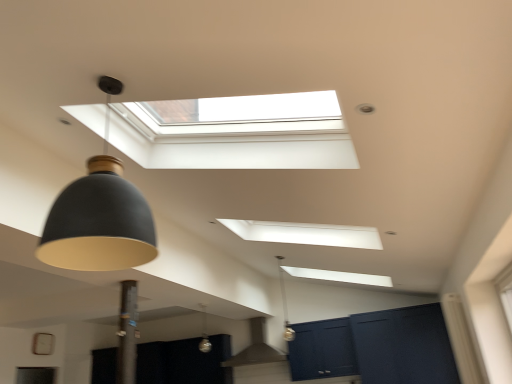
Question: Which direction should I rotate to face matte black pendant light at center, which is the third lamp from left to right, — up or down?

Choices:
 (A) down
 (B) up

Answer: (A)

Question: Is matte gray exhaust hood at center directly adjacent to white matte window at right?

Choices:
 (A) no
 (B) yes

Answer: (A)

Question: Can you confirm if matte gray exhaust hood at center is positioned to the left of white matte window at right?

Choices:
 (A) no
 (B) yes

Answer: (B)

Question: Does matte gray exhaust hood at center have a greater width compared to white matte window at right?

Choices:
 (A) yes
 (B) no

Answer: (A)

Question: Is matte gray exhaust hood at center oriented away from white matte window at right?

Choices:
 (A) yes
 (B) no

Answer: (B)

Question: From the image's perspective, is matte gray exhaust hood at center beneath white matte window at right?

Choices:
 (A) yes
 (B) no

Answer: (A)

Question: Can we say matte gray exhaust hood at center lies outside white matte window at right?

Choices:
 (A) yes
 (B) no

Answer: (A)

Question: Considering the relative sizes of white matte window at right and matte dark blue cabinet at lower right in the image provided, is white matte window at right thinner than matte dark blue cabinet at lower right?

Choices:
 (A) no
 (B) yes

Answer: (B)

Question: From the image's perspective, is white matte window at right on top of matte dark blue cabinet at lower right?

Choices:
 (A) yes
 (B) no

Answer: (A)

Question: From a real-world perspective, is white matte window at right over matte dark blue cabinet at lower right?

Choices:
 (A) yes
 (B) no

Answer: (B)

Question: Is white matte window at right positioned before matte dark blue cabinet at lower right?

Choices:
 (A) no
 (B) yes

Answer: (B)

Question: Considering the relative sizes of white matte window at right and matte dark blue cabinet at lower right in the image provided, is white matte window at right wider than matte dark blue cabinet at lower right?

Choices:
 (A) yes
 (B) no

Answer: (B)

Question: Considering the relative positions of white matte window at right and matte dark blue cabinet at lower right in the image provided, is white matte window at right to the right of matte dark blue cabinet at lower right from the viewer's perspective?

Choices:
 (A) yes
 (B) no

Answer: (B)

Question: From the image's perspective, does matte gray exhaust hood at center appear lower than matte black lampshade at left, which is the second lamp in right-to-left order?

Choices:
 (A) yes
 (B) no

Answer: (A)